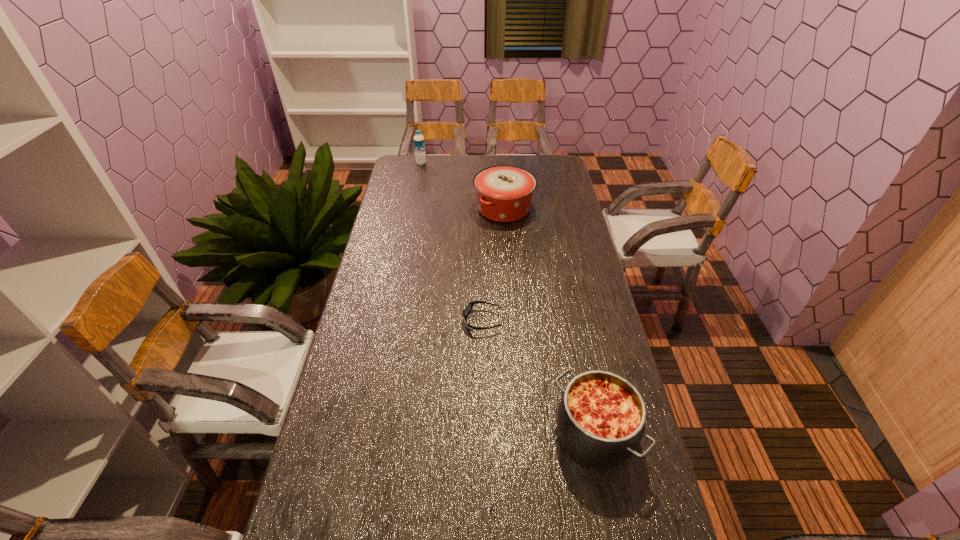
Locate an element on the screen. The height and width of the screenshot is (540, 960). water bottle is located at coordinates (419, 144).

This screenshot has width=960, height=540. In order to click on the farthest object in this screenshot , I will do `click(419, 144)`.

Where is `the farther casserole`? The height and width of the screenshot is (540, 960). the farther casserole is located at coordinates (504, 193).

The height and width of the screenshot is (540, 960). What are the coordinates of `the second shortest object` in the screenshot? It's located at (601, 416).

Where is `the nearest object`? This screenshot has width=960, height=540. the nearest object is located at coordinates (601, 416).

Locate an element on the screen. The image size is (960, 540). the third farthest object is located at coordinates (468, 308).

The image size is (960, 540). I want to click on the shortest object, so click(x=468, y=308).

You are a GUI agent. You are given a task and a screenshot of the screen. Output one action in this format:
    pyautogui.click(x=<x>, y=<y>)
    Task: Click on the vacant point located on the label of the water bottle
    The image size is (960, 540).
    Given the screenshot: What is the action you would take?
    pyautogui.click(x=496, y=164)

Locate an element on the screen. vacant space located 0.290m on the left of the farther casserole is located at coordinates (404, 208).

Locate an element on the screen. This screenshot has width=960, height=540. vacant point located on the left of the nearer casserole is located at coordinates (456, 434).